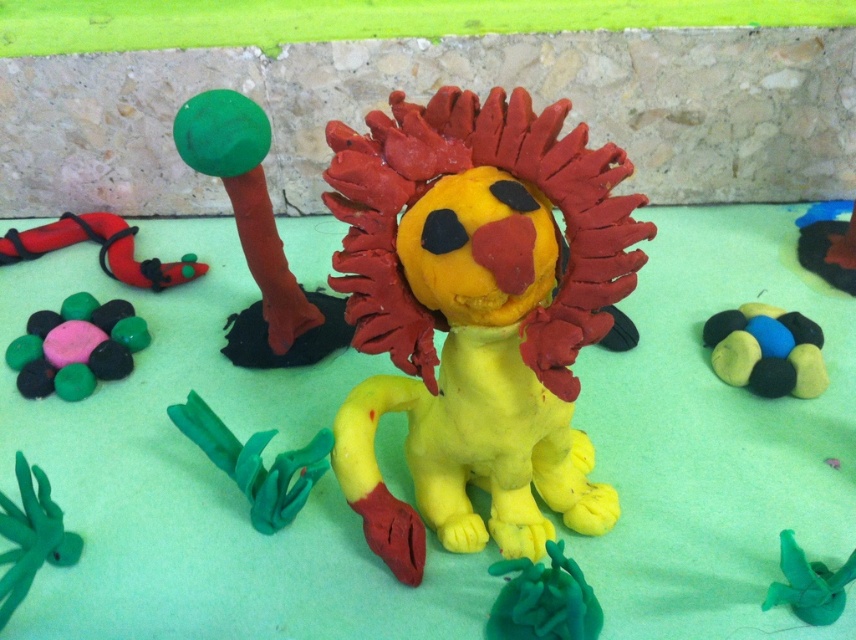
Who is taller, green matte ball at upper left or matte green leaf at lower right?

Standing taller between the two is green matte ball at upper left.

Can you confirm if green matte ball at upper left is positioned to the right of matte green leaf at lower right?

In fact, green matte ball at upper left is to the left of matte green leaf at lower right.

The height and width of the screenshot is (640, 856). Identify the location of green matte ball at upper left. (256, 236).

Find the location of a particular element. This screenshot has height=640, width=856. smooth clay pebbles at lower left is located at coordinates (76, 348).

Does smooth clay pebbles at lower left have a lesser width compared to smooth black stone at upper right?

In fact, smooth clay pebbles at lower left might be wider than smooth black stone at upper right.

Identify the location of smooth clay pebbles at lower left. (76, 348).

I want to click on smooth clay pebbles at lower left, so click(x=76, y=348).

Between matte green leaf at lower right and smooth black stone at upper right, which one has less height?

With less height is matte green leaf at lower right.

Measure the distance between matte green leaf at lower right and smooth black stone at upper right.

matte green leaf at lower right and smooth black stone at upper right are 24.19 inches apart.

Is point (801, 605) farther from viewer compared to point (800, 256)?

No.

Locate an element on the screen. This screenshot has height=640, width=856. matte green leaf at lower right is located at coordinates (809, 584).